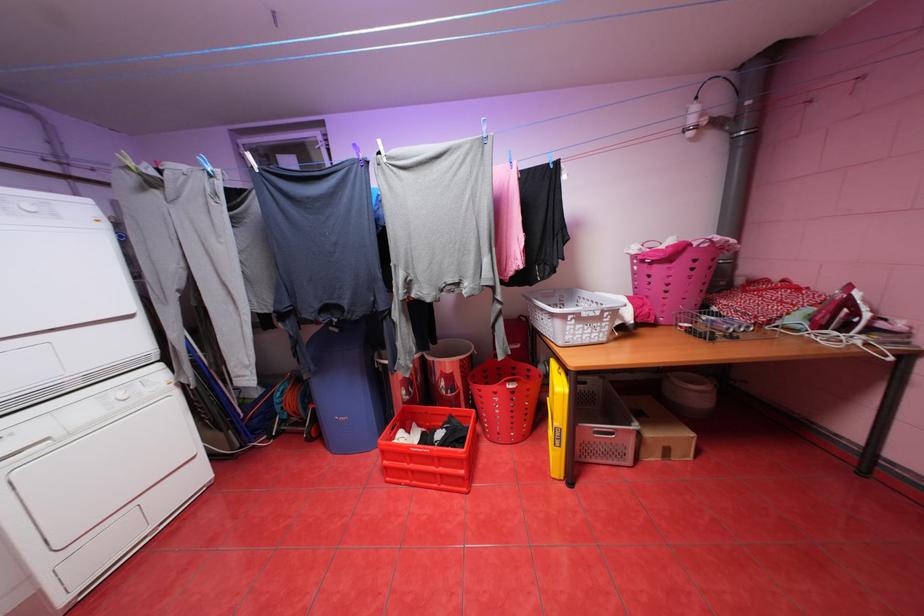
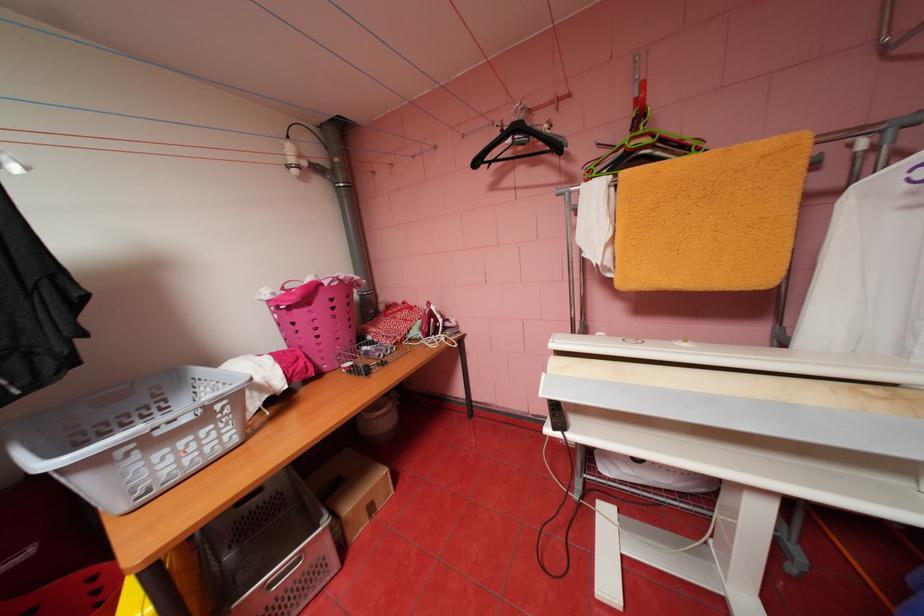
In the second image, find the point that corresponds to (x=675, y=451) in the first image.

(380, 508)